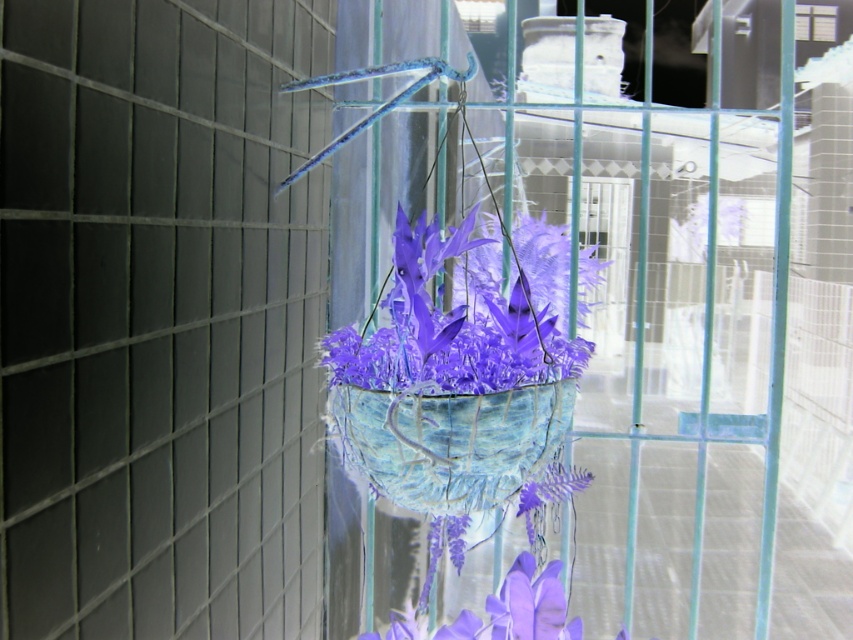
Question: Which point is farther to the camera?

Choices:
 (A) (x=344, y=403)
 (B) (x=479, y=419)

Answer: (A)

Question: Does matte purple paper flowers at center have a larger size compared to textured blue basket at center?

Choices:
 (A) yes
 (B) no

Answer: (A)

Question: Is matte purple paper flowers at center to the right of textured blue basket at center from the viewer's perspective?

Choices:
 (A) no
 (B) yes

Answer: (B)

Question: Among these points, which one is farthest from the camera?

Choices:
 (A) (410, 292)
 (B) (460, 356)
 (C) (432, 420)

Answer: (B)

Question: Which point is farther to the camera?

Choices:
 (A) (409, 493)
 (B) (447, 472)
 (C) (497, 241)

Answer: (C)

Question: Does matte blue fabric basket at center appear on the left side of textured blue basket at center?

Choices:
 (A) no
 (B) yes

Answer: (A)